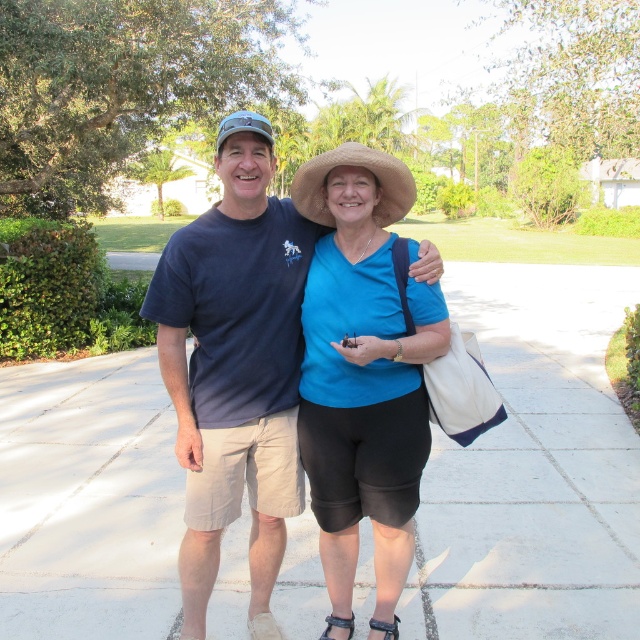
Question: Observing the image, what is the correct spatial positioning of white concrete pavement at center in reference to straw hat at center?

Choices:
 (A) below
 (B) above

Answer: (A)

Question: Is white concrete pavement at center smaller than blue matte shirt at center?

Choices:
 (A) no
 (B) yes

Answer: (A)

Question: Which point appears closest to the camera in this image?

Choices:
 (A) (625, 586)
 (B) (396, 176)

Answer: (B)

Question: Which object appears closest to the camera in this image?

Choices:
 (A) straw hat at center
 (B) white concrete pavement at center

Answer: (A)

Question: Can you confirm if white concrete pavement at center is positioned below blue matte shirt at center?

Choices:
 (A) yes
 (B) no

Answer: (A)

Question: Which object appears farthest from the camera in this image?

Choices:
 (A) matte blue shirt at center
 (B) straw hat at center

Answer: (B)